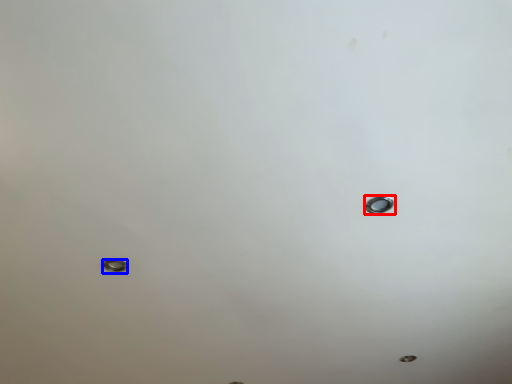
Question: Which object appears closest to the camera in this image, nail (highlighted by a red box) or bolt (highlighted by a blue box)?

Choices:
 (A) nail
 (B) bolt

Answer: (A)